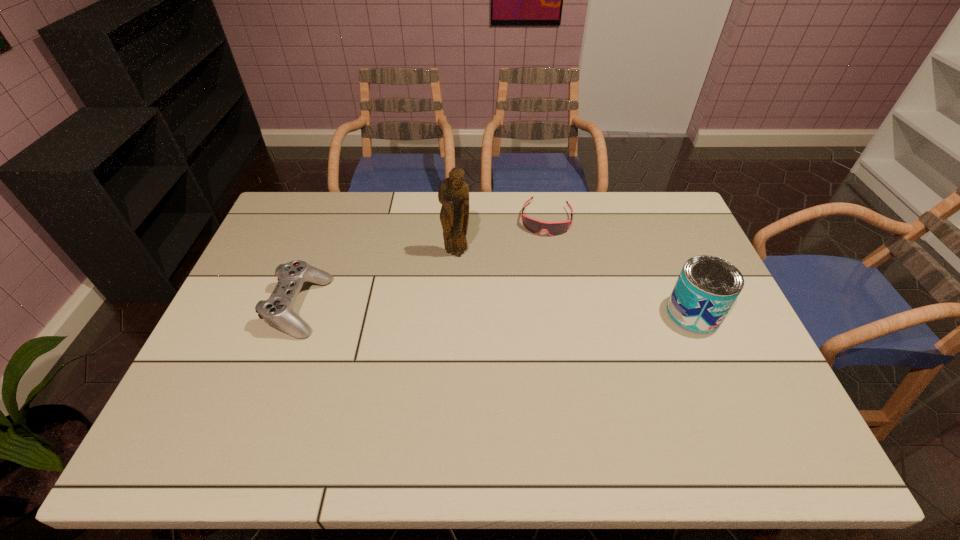
You are a GUI agent. You are given a task and a screenshot of the screen. Output one action in this format:
    pyautogui.click(x=<x>, y=<y>)
    Task: Click on the third tallest object
    Image resolution: width=960 pixels, height=540 pixels.
    Given the screenshot: What is the action you would take?
    pyautogui.click(x=277, y=311)

In order to click on control in this screenshot , I will do (277, 311).

Locate an element on the screen. The height and width of the screenshot is (540, 960). can is located at coordinates (707, 287).

The image size is (960, 540). I want to click on the rightmost object, so point(707,287).

The width and height of the screenshot is (960, 540). What are the coordinates of `the second object from right to left` in the screenshot? It's located at (535, 226).

Image resolution: width=960 pixels, height=540 pixels. In order to click on the farthest object in this screenshot , I will do `click(535, 226)`.

Where is `figurine`? This screenshot has width=960, height=540. figurine is located at coordinates (453, 193).

Locate an element on the screen. the tallest object is located at coordinates (453, 193).

Find the location of `blank space located on the back of the leftmost object`. blank space located on the back of the leftmost object is located at coordinates (335, 210).

In order to click on blank space located on the back of the can in this screenshot , I will do 666,251.